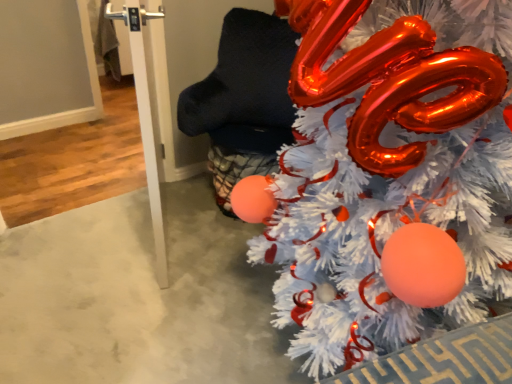
I want to click on free space to the left of white fluffy christmas tree at right, so click(145, 295).